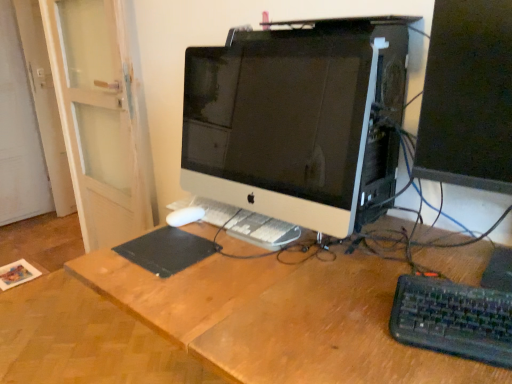
Locate an element on the screen. Image resolution: width=512 pixels, height=384 pixels. vacant space in front of white glossy computer monitor at center, the first computer monitor viewed from the left is located at coordinates (273, 302).